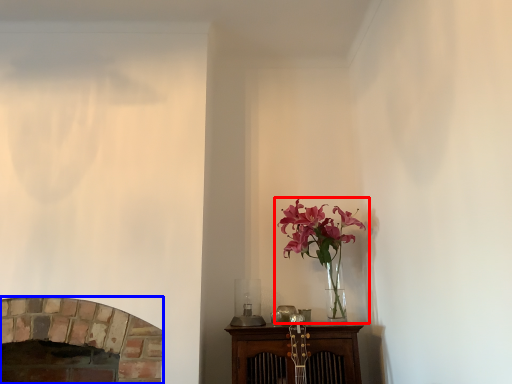
Question: Which of the following is the closest to the observer, houseplant (highlighted by a red box) or fireplace (highlighted by a blue box)?

Choices:
 (A) houseplant
 (B) fireplace

Answer: (B)